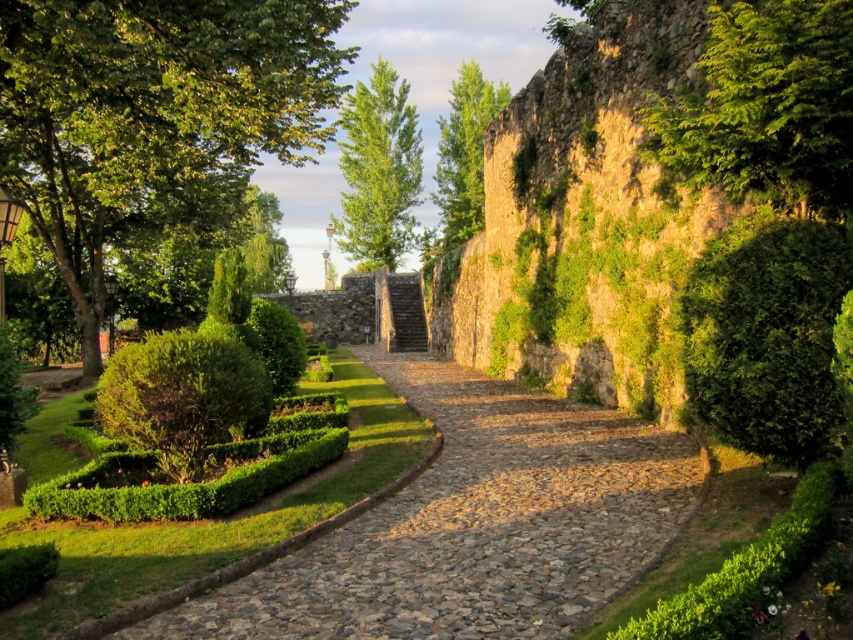
Question: Is green leafy tree at center to the right of green leafy bush at center from the viewer's perspective?

Choices:
 (A) yes
 (B) no

Answer: (B)

Question: Does brown cobblestone path at center have a greater width compared to green leafy tree at left?

Choices:
 (A) no
 (B) yes

Answer: (A)

Question: Which point is farther from the camera taking this photo?

Choices:
 (A) (718, 138)
 (B) (358, 264)

Answer: (B)

Question: Which object is the farthest from the brown cobblestone path at center?

Choices:
 (A) green leafy bush at center-left
 (B) green leafy tree at left

Answer: (B)

Question: Does green leafy tree at left appear under green leafy tree at upper center?

Choices:
 (A) yes
 (B) no

Answer: (A)

Question: Which point is closer to the camera taking this photo?

Choices:
 (A) (456, 378)
 (B) (142, 426)
 (C) (724, 428)

Answer: (C)